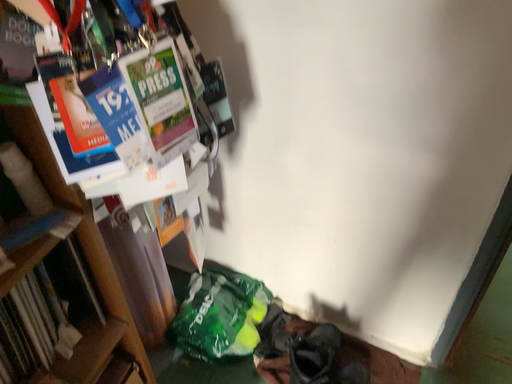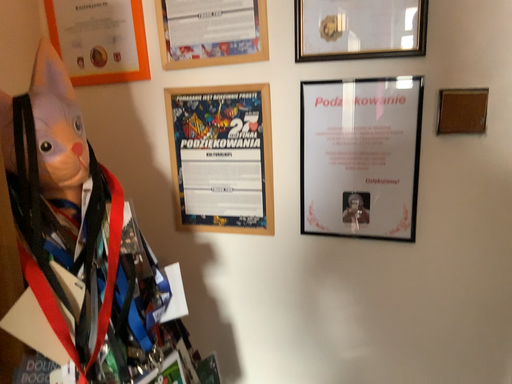
Question: Which way did the camera rotate in the video?

Choices:
 (A) rotated upward
 (B) rotated downward

Answer: (A)